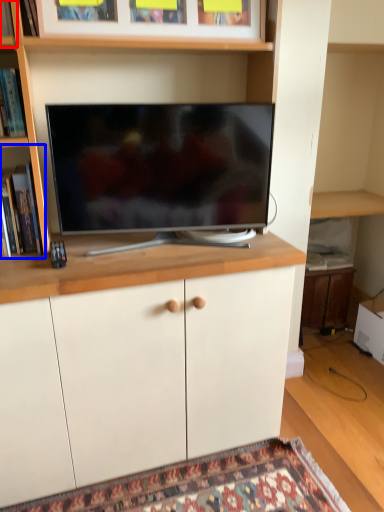
Question: Which of the following is the farthest to the observer, shelf (highlighted by a red box) or shelf (highlighted by a blue box)?

Choices:
 (A) shelf
 (B) shelf

Answer: (B)